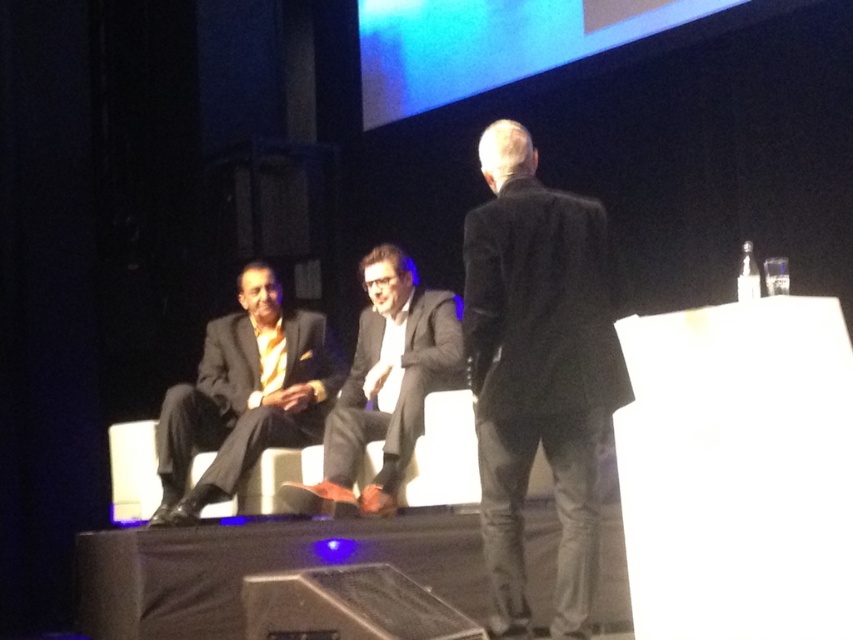
What do you see at coordinates (538, 369) in the screenshot?
I see `black matte suit at center` at bounding box center [538, 369].

Does black matte suit at center appear over metallic silver speaker at lower center?

Indeed, black matte suit at center is positioned over metallic silver speaker at lower center.

Is point (581, 480) closer to camera compared to point (270, 627)?

No, it is not.

Where is `black matte suit at center`? black matte suit at center is located at coordinates (538, 369).

In the scene shown: Who is shorter, black matte suit at center or matte black suit at center?

Standing shorter between the two is matte black suit at center.

Is the position of black matte suit at center more distant than that of matte black suit at center?

No, it is not.

Between point (474, 316) and point (338, 456), which one is positioned behind?

The point (338, 456) is more distant.

The height and width of the screenshot is (640, 853). What are the coordinates of `black matte suit at center` in the screenshot? It's located at (538, 369).

Between point (236, 376) and point (393, 637), which one is positioned in front?

Point (393, 637) is more forward.

The height and width of the screenshot is (640, 853). Describe the element at coordinates (244, 401) in the screenshot. I see `matte black suit at left` at that location.

The image size is (853, 640). What do you see at coordinates (244, 401) in the screenshot?
I see `matte black suit at left` at bounding box center [244, 401].

The image size is (853, 640). What are the coordinates of `matte black suit at left` in the screenshot? It's located at (244, 401).